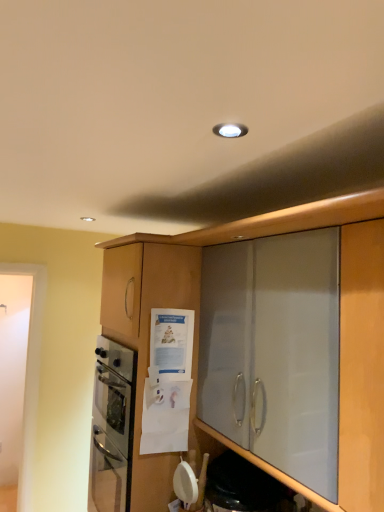
Image resolution: width=384 pixels, height=512 pixels. What do you see at coordinates (149, 336) in the screenshot?
I see `matte wood cabinet at center` at bounding box center [149, 336].

Measure the distance between point (186, 263) and camera.

They are 1.84 meters apart.

Locate an element on the screen. matte wood cabinet at center is located at coordinates (149, 336).

Locate an element on the screen. transparent glass shelf at lower center is located at coordinates (269, 469).

Image resolution: width=384 pixels, height=512 pixels. What do you see at coordinates (269, 469) in the screenshot?
I see `transparent glass shelf at lower center` at bounding box center [269, 469].

This screenshot has height=512, width=384. What are the coordinates of `matte wood cabinet at center` in the screenshot? It's located at (149, 336).

Can you confirm if transparent glass shelf at lower center is positioned to the right of matte wood cabinet at center?

Indeed, transparent glass shelf at lower center is positioned on the right side of matte wood cabinet at center.

Which is behind, transparent glass shelf at lower center or matte wood cabinet at center?

matte wood cabinet at center is further away from the camera.

Does point (250, 454) come closer to viewer compared to point (201, 256)?

Yes, it is in front of point (201, 256).

From the picture: From the image's perspective, which object appears higher, transparent glass shelf at lower center or matte wood cabinet at center?

matte wood cabinet at center, from the image's perspective.

From a real-world perspective, is transparent glass shelf at lower center physically located above or below matte wood cabinet at center?

From a real-world perspective, transparent glass shelf at lower center is physically below matte wood cabinet at center.

Is transparent glass shelf at lower center wider or thinner than matte wood cabinet at center?

transparent glass shelf at lower center is thinner than matte wood cabinet at center.

From their relative heights in the image, would you say transparent glass shelf at lower center is taller or shorter than matte wood cabinet at center?

transparent glass shelf at lower center is shorter than matte wood cabinet at center.

Based on the photo, is transparent glass shelf at lower center bigger than matte wood cabinet at center?

Incorrect, transparent glass shelf at lower center is not larger than matte wood cabinet at center.

Would you say transparent glass shelf at lower center is outside matte wood cabinet at center?

Yes.

Can you see transparent glass shelf at lower center touching matte wood cabinet at center?

No, transparent glass shelf at lower center is not with matte wood cabinet at center.

Could you tell me if transparent glass shelf at lower center is turned towards matte wood cabinet at center?

No.

Locate an element on the screen. This screenshot has width=384, height=512. cabinetry above the transparent glass shelf at lower center (from the image's perspective) is located at coordinates (149, 336).

Considering the relative positions of matte wood cabinet at center and transparent glass shelf at lower center in the image provided, is matte wood cabinet at center to the left of transparent glass shelf at lower center from the viewer's perspective?

Correct, you'll find matte wood cabinet at center to the left of transparent glass shelf at lower center.

In the scene shown: Is matte wood cabinet at center closer to the viewer compared to transparent glass shelf at lower center?

No, it is behind transparent glass shelf at lower center.

Which is in front, point (115, 327) or point (235, 446)?

The point (235, 446) is more forward.

From the image's perspective, is matte wood cabinet at center beneath transparent glass shelf at lower center?

No, from the image's perspective, matte wood cabinet at center is not below transparent glass shelf at lower center.

From a real-world perspective, is matte wood cabinet at center physically below transparent glass shelf at lower center?

No, from a real-world perspective, matte wood cabinet at center is not below transparent glass shelf at lower center.

Does matte wood cabinet at center have a lesser width compared to transparent glass shelf at lower center?

Incorrect, the width of matte wood cabinet at center is not less than that of transparent glass shelf at lower center.

Considering the sizes of matte wood cabinet at center and transparent glass shelf at lower center in the image, is matte wood cabinet at center taller or shorter than transparent glass shelf at lower center?

matte wood cabinet at center is taller than transparent glass shelf at lower center.

Between matte wood cabinet at center and transparent glass shelf at lower center, which one has larger size?

Bigger between the two is matte wood cabinet at center.

Is transparent glass shelf at lower center surrounded by matte wood cabinet at center?

No, transparent glass shelf at lower center is located outside of matte wood cabinet at center.

Is matte wood cabinet at center not near transparent glass shelf at lower center?

Actually, matte wood cabinet at center and transparent glass shelf at lower center are a little close together.

Is matte wood cabinet at center looking in the opposite direction of transparent glass shelf at lower center?

matte wood cabinet at center is not turned away from transparent glass shelf at lower center.

The width and height of the screenshot is (384, 512). What are the coordinates of `cabinetry behind the transparent glass shelf at lower center` in the screenshot? It's located at (149, 336).

I want to click on cabinetry behind the transparent glass shelf at lower center, so click(149, 336).

Locate an element on the screen. The image size is (384, 512). shelf below the matte wood cabinet at center (from the image's perspective) is located at coordinates (269, 469).